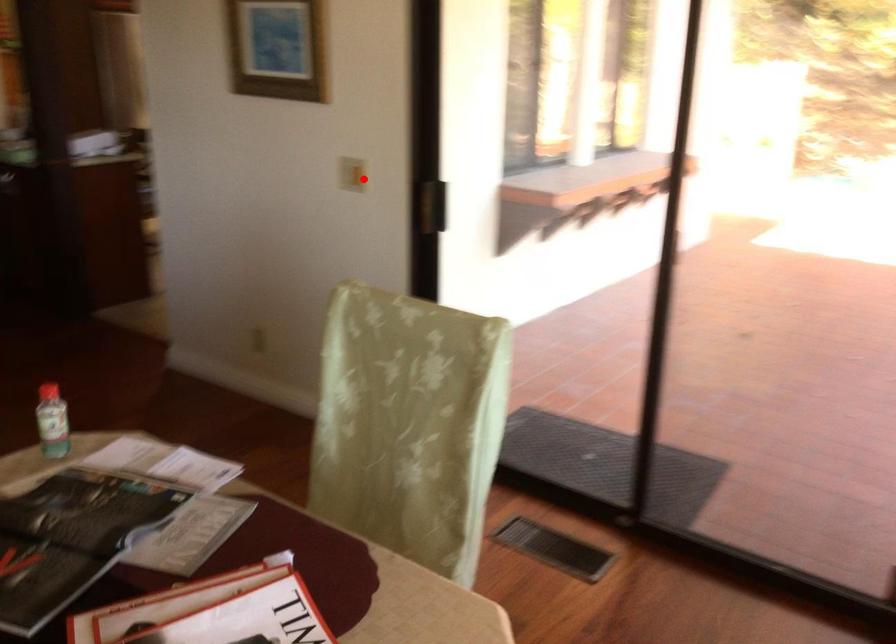
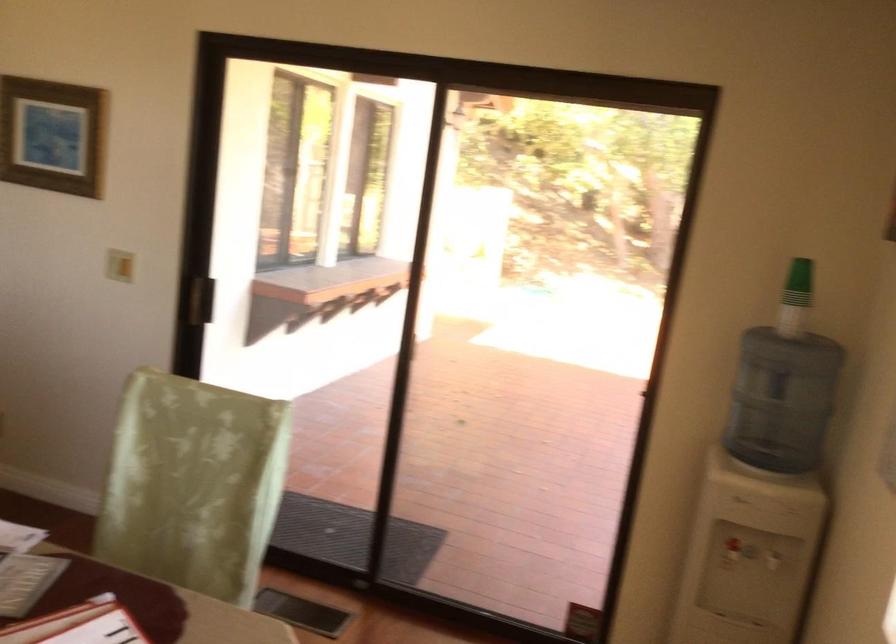
Where in the second image is the point corresponding to the highlighted location from the first image?

(119, 265)